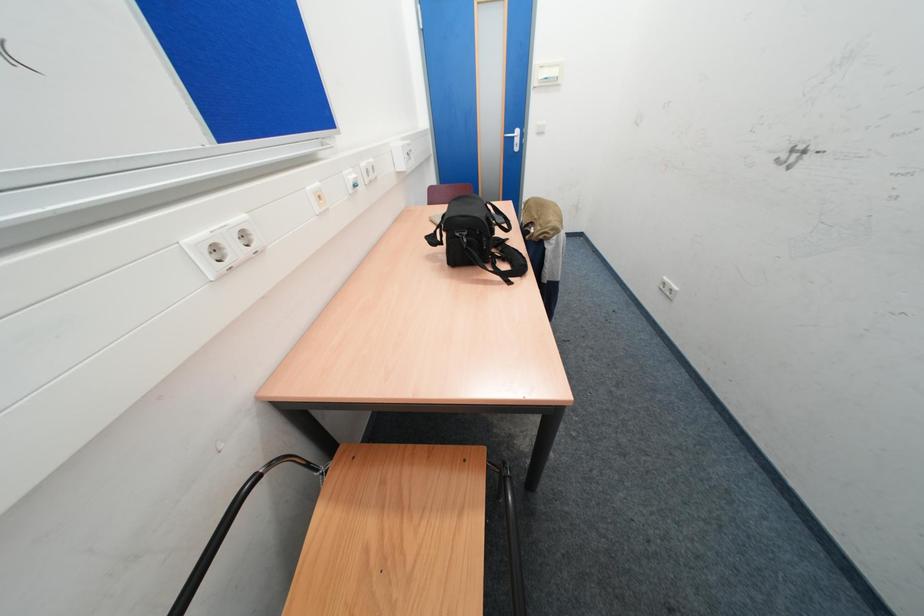
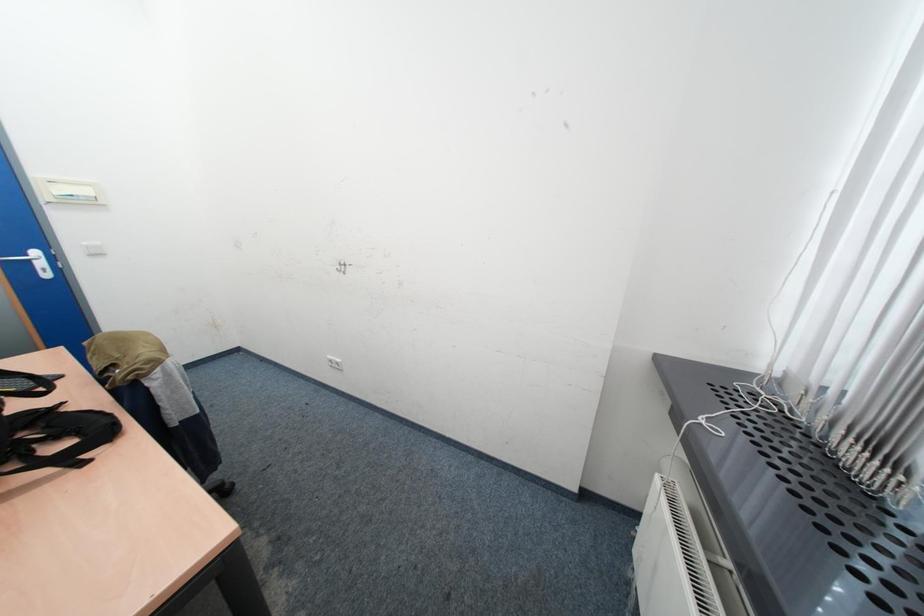
Question: How did the camera likely rotate?

Choices:
 (A) Left
 (B) Right
 (C) Up
 (D) Down

Answer: (B)